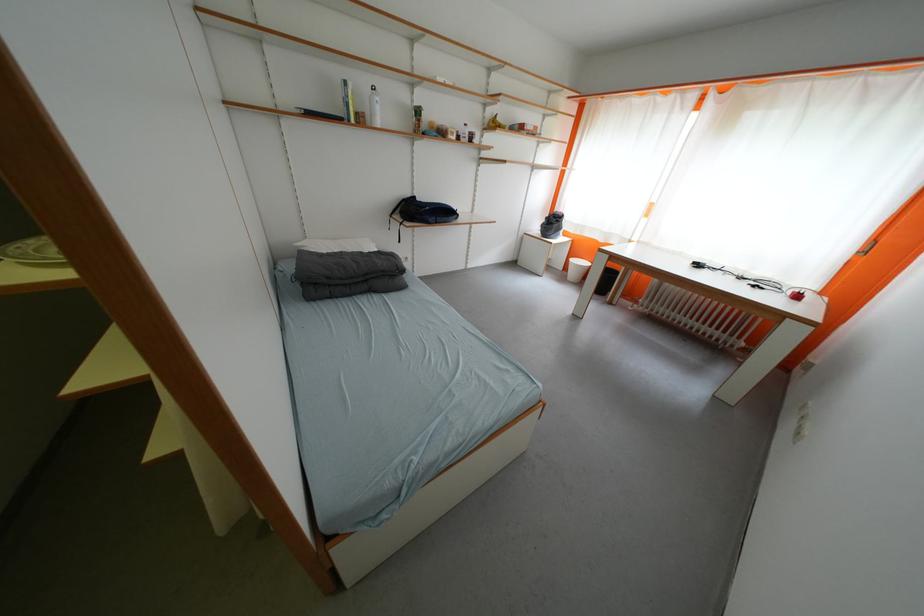
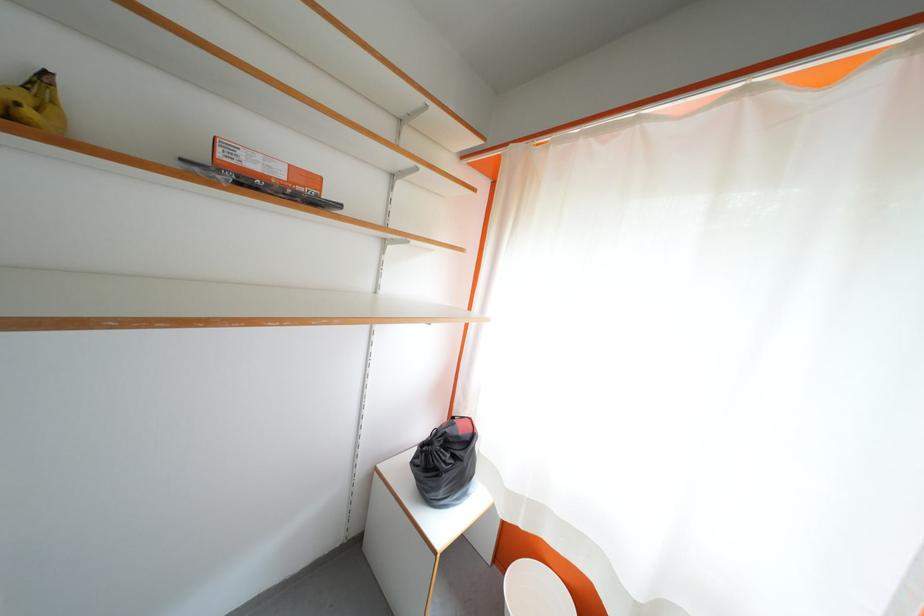
The point at (562, 225) is marked in the first image. Where is the corresponding point in the second image?

(455, 460)